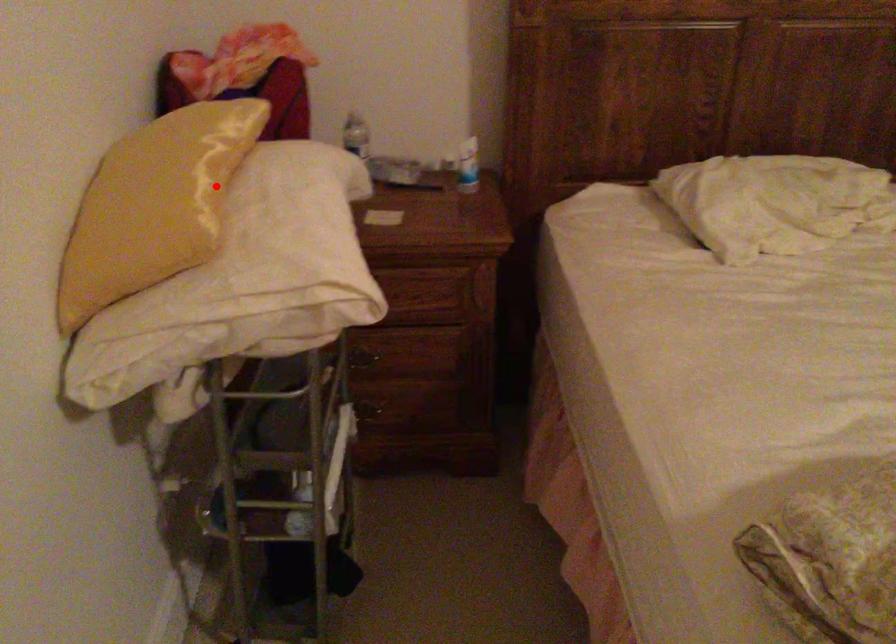
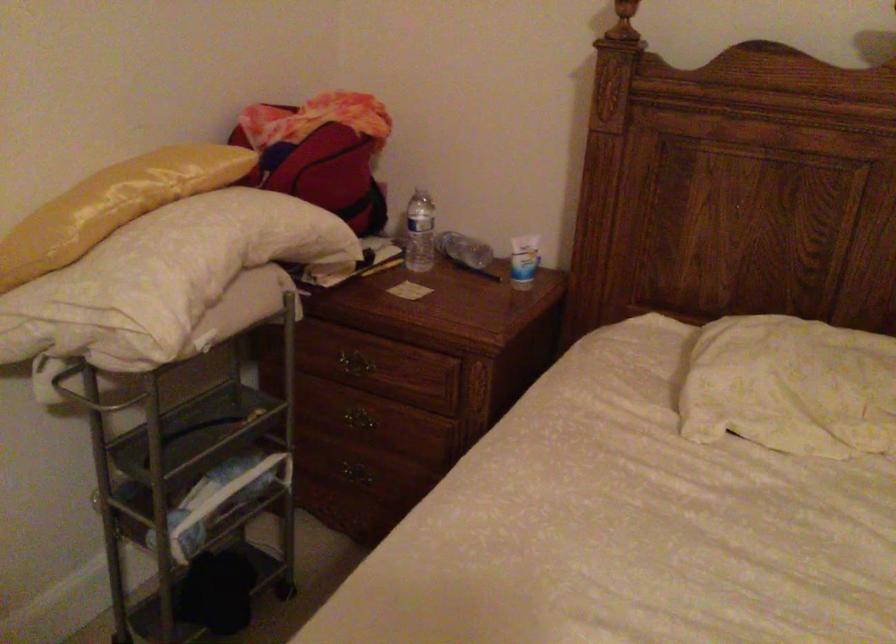
In the second image, find the point that corresponds to the highlighted location in the first image.

(113, 205)